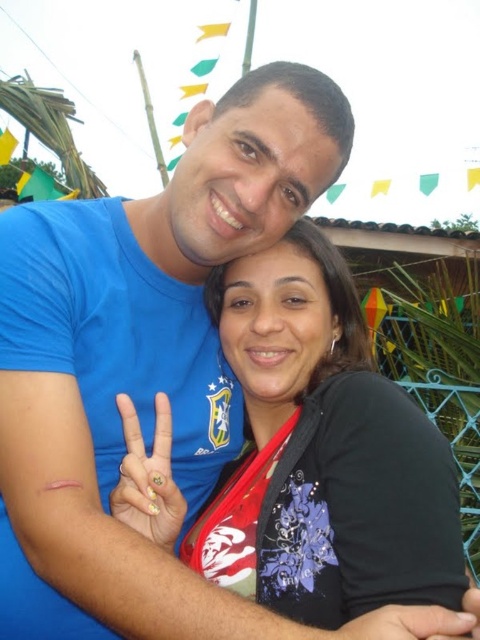
Between matte black shirt at center and gold glitter nail polish at center, which one is positioned higher?

matte black shirt at center is higher up.

Which is behind, point (280, 260) or point (132, 497)?

The point (280, 260) is behind.

Find the location of `matte black shirt at center`. matte black shirt at center is located at coordinates (324, 452).

Does gold glitter nail polish at center appear under smooth skin hand at center?

Incorrect, gold glitter nail polish at center is not positioned below smooth skin hand at center.

Is point (132, 486) farther from camera compared to point (386, 624)?

Yes, it is behind point (386, 624).

Where is `gold glitter nail polish at center`? gold glitter nail polish at center is located at coordinates (147, 477).

Between matte black shirt at center and smooth skin hand at center, which one is positioned higher?

Positioned higher is matte black shirt at center.

Who is more distant from viewer, (x=252, y=422) or (x=450, y=637)?

The point (x=252, y=422) is more distant.

This screenshot has width=480, height=640. I want to click on matte black shirt at center, so click(324, 452).